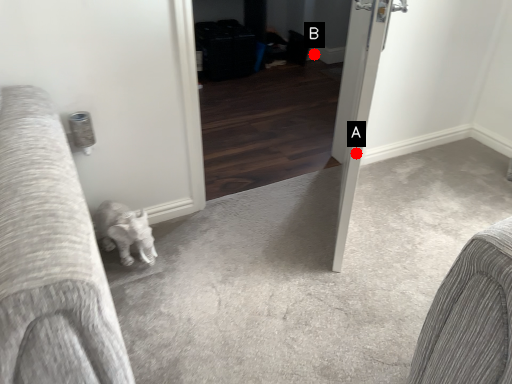
Question: Two points are circled on the image, labeled by A and B beside each circle. Which point is further to the camera?

Choices:
 (A) A is further
 (B) B is further

Answer: (B)